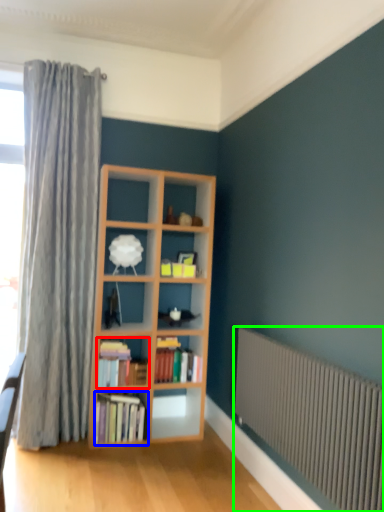
Question: Considering the real-world distances, which object is farthest from book (highlighted by a red box)? book (highlighted by a blue box) or radiator (highlighted by a green box)?

Choices:
 (A) book
 (B) radiator

Answer: (B)